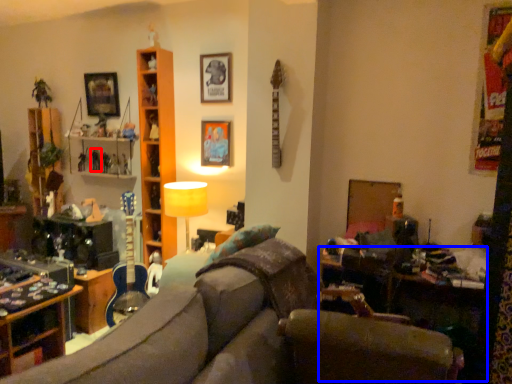
Question: Which object appears closest to the camera in this image, toy (highlighted by a red box) or table (highlighted by a blue box)?

Choices:
 (A) toy
 (B) table

Answer: (B)